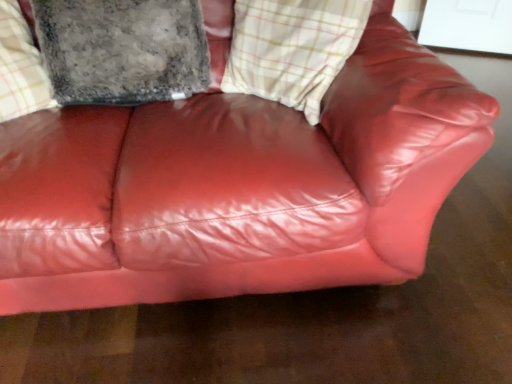
Question: Is fuzzy gray pillow at upper left smaller than plaid fabric cushion at upper center?

Choices:
 (A) yes
 (B) no

Answer: (B)

Question: Is fuzzy gray pillow at upper left to the right of plaid fabric cushion at upper center from the viewer's perspective?

Choices:
 (A) yes
 (B) no

Answer: (B)

Question: Does fuzzy gray pillow at upper left lie in front of plaid fabric cushion at upper center?

Choices:
 (A) no
 (B) yes

Answer: (A)

Question: From a real-world perspective, is fuzzy gray pillow at upper left physically below plaid fabric cushion at upper center?

Choices:
 (A) yes
 (B) no

Answer: (B)

Question: Is fuzzy gray pillow at upper left further to the viewer compared to plaid fabric cushion at upper center?

Choices:
 (A) yes
 (B) no

Answer: (A)

Question: Is fuzzy gray pillow at upper left shorter than plaid fabric cushion at upper center?

Choices:
 (A) no
 (B) yes

Answer: (B)

Question: Is plaid fabric cushion at upper center wider than fuzzy gray pillow at upper left?

Choices:
 (A) yes
 (B) no

Answer: (B)

Question: Can you confirm if plaid fabric cushion at upper center is taller than fuzzy gray pillow at upper left?

Choices:
 (A) no
 (B) yes

Answer: (B)

Question: Can you confirm if plaid fabric cushion at upper center is thinner than fuzzy gray pillow at upper left?

Choices:
 (A) yes
 (B) no

Answer: (A)

Question: Is plaid fabric cushion at upper center outside of fuzzy gray pillow at upper left?

Choices:
 (A) yes
 (B) no

Answer: (A)

Question: From the image's perspective, is plaid fabric cushion at upper center above fuzzy gray pillow at upper left?

Choices:
 (A) yes
 (B) no

Answer: (B)

Question: From a real-world perspective, is plaid fabric cushion at upper center beneath fuzzy gray pillow at upper left?

Choices:
 (A) no
 (B) yes

Answer: (B)

Question: Considering the positions of fuzzy gray pillow at upper left and plaid fabric cushion at upper center in the image, is fuzzy gray pillow at upper left taller or shorter than plaid fabric cushion at upper center?

Choices:
 (A) tall
 (B) short

Answer: (B)